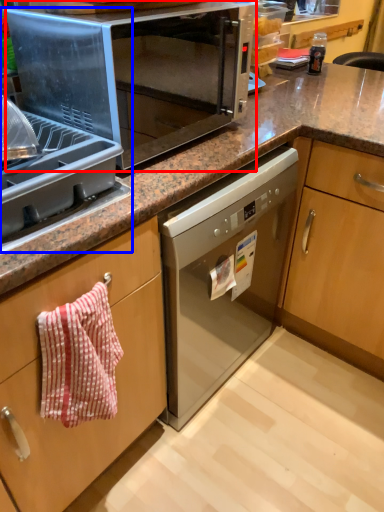
Question: Among these objects, which one is nearest to the camera, microwave oven (highlighted by a red box) or appliance (highlighted by a blue box)?

Choices:
 (A) microwave oven
 (B) appliance

Answer: (B)